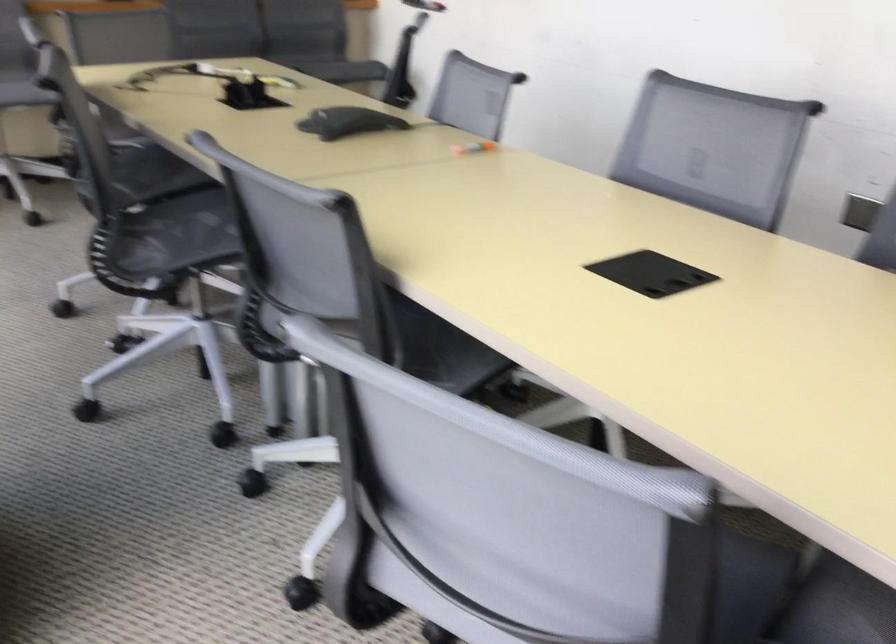
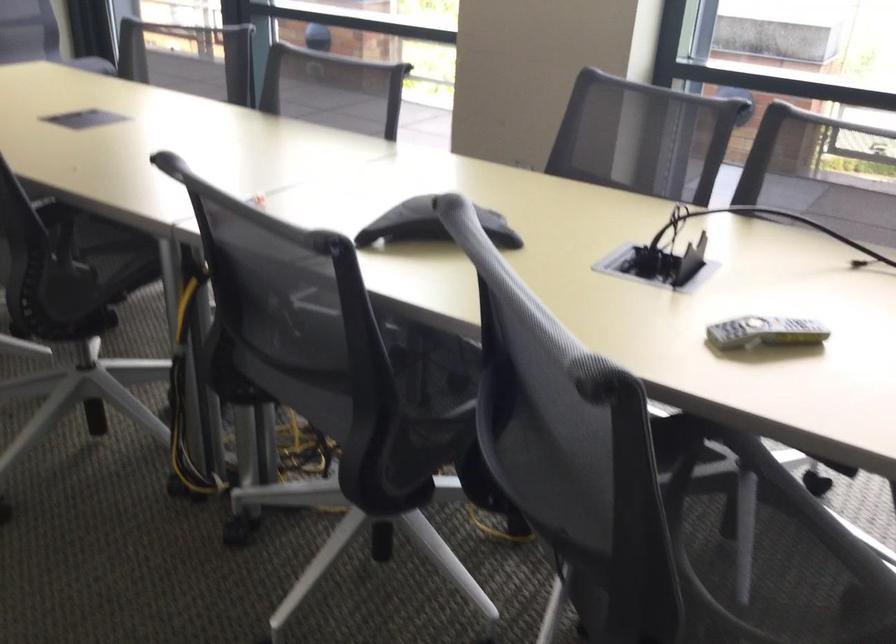
Question: I am providing you with two images of the same scene from different viewpoints. Which of the following objects are not visible in image2?

Choices:
 (A) black conference phone
 (B) chair sitting surface
 (C) laptop bag handle
 (D) grey remote control

Answer: (B)